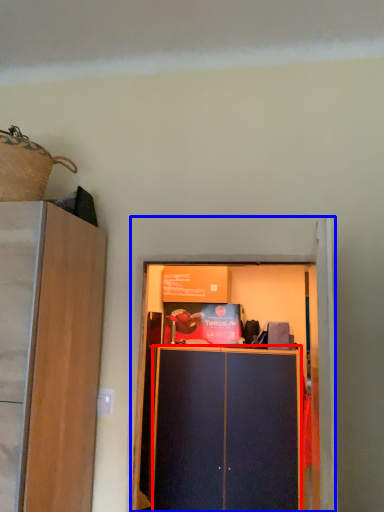
Question: Which point is further to the camera, cabinetry (highlighted by a red box) or cupboard (highlighted by a blue box)?

Choices:
 (A) cabinetry
 (B) cupboard

Answer: (A)